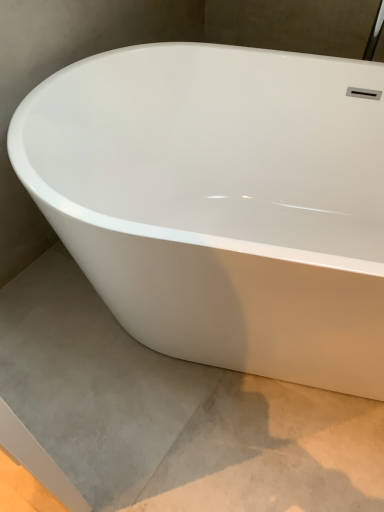
Image resolution: width=384 pixels, height=512 pixels. What are the coordinates of `free space above gray concrete at lower left (from a real-world perspective)` in the screenshot? It's located at (149, 402).